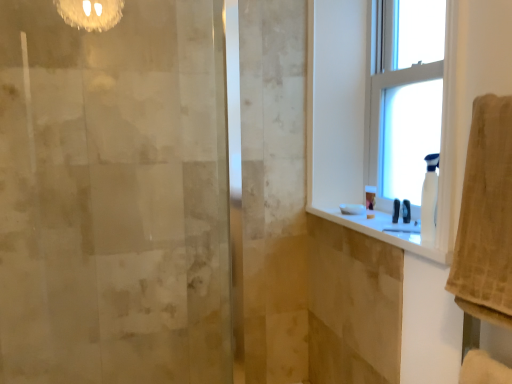
Question: Is white glossy counter top at upper right at the back of beige textured towel at right?

Choices:
 (A) no
 (B) yes

Answer: (A)

Question: From the image's perspective, is beige textured towel at right over white glossy counter top at upper right?

Choices:
 (A) no
 (B) yes

Answer: (B)

Question: Is beige textured towel at right in contact with white glossy counter top at upper right?

Choices:
 (A) yes
 (B) no

Answer: (B)

Question: Can you confirm if beige textured towel at right is positioned to the left of white glossy counter top at upper right?

Choices:
 (A) yes
 (B) no

Answer: (B)

Question: Can you confirm if beige textured towel at right is wider than white glossy counter top at upper right?

Choices:
 (A) no
 (B) yes

Answer: (A)

Question: Looking at their shapes, would you say white plastic spray bottle at right is wider or thinner than white glossy counter top at upper right?

Choices:
 (A) thin
 (B) wide

Answer: (A)

Question: From a real-world perspective, is white plastic spray bottle at right positioned above or below white glossy counter top at upper right?

Choices:
 (A) below
 (B) above

Answer: (B)

Question: From the image's perspective, is white plastic spray bottle at right positioned above or below white glossy counter top at upper right?

Choices:
 (A) below
 (B) above

Answer: (B)

Question: Would you say white plastic spray bottle at right is inside or outside white glossy counter top at upper right?

Choices:
 (A) inside
 (B) outside

Answer: (B)

Question: Based on their sizes in the image, would you say white plastic window at upper right, the second window in the right-to-left sequence, is bigger or smaller than beige textured towel at right?

Choices:
 (A) big
 (B) small

Answer: (A)

Question: Considering the positions of white plastic window at upper right, which is the first window in left-to-right order, and beige textured towel at right in the image, is white plastic window at upper right, which is the first window in left-to-right order, taller or shorter than beige textured towel at right?

Choices:
 (A) tall
 (B) short

Answer: (A)

Question: From the image's perspective, is white plastic window at upper right, the second window in the right-to-left sequence, above or below beige textured towel at right?

Choices:
 (A) above
 (B) below

Answer: (A)

Question: Looking at their shapes, would you say white plastic window at upper right, which is the first window in left-to-right order, is wider or thinner than beige textured towel at right?

Choices:
 (A) thin
 (B) wide

Answer: (A)

Question: In terms of size, does white plastic window at upper right, which is the first window in left-to-right order, appear bigger or smaller than white glossy counter top at upper right?

Choices:
 (A) small
 (B) big

Answer: (B)

Question: Would you say white plastic window at upper right, which is the first window in left-to-right order, is inside or outside white glossy counter top at upper right?

Choices:
 (A) outside
 (B) inside

Answer: (A)